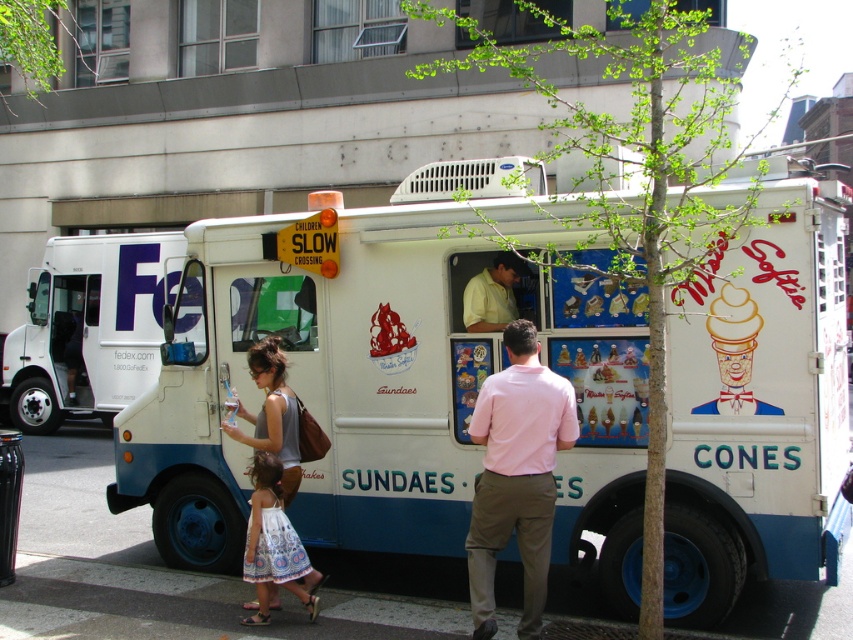
Is white matte ice cream truck at center further to camera compared to matte gray tank top at center?

No, it is in front of matte gray tank top at center.

Is white matte ice cream truck at center taller than matte gray tank top at center?

Yes, white matte ice cream truck at center is taller than matte gray tank top at center.

At what (x,y) coordinates should I click in order to perform the action: click on white matte ice cream truck at center. Please return your answer as a coordinate pair (x, y). Looking at the image, I should click on (317, 380).

What do you see at coordinates (317, 380) in the screenshot?
I see `white matte ice cream truck at center` at bounding box center [317, 380].

Does white matte ice cream truck at center appear over white printed dress at lower center?

Correct, white matte ice cream truck at center is located above white printed dress at lower center.

Which is in front, point (399, 272) or point (259, 529)?

Point (259, 529) is in front.

Locate an element on the screen. The height and width of the screenshot is (640, 853). white matte ice cream truck at center is located at coordinates (317, 380).

Who is more forward, (x=590, y=273) or (x=482, y=330)?

Point (x=590, y=273) is in front.

Does white matte ice cream truck at center have a larger size compared to yellow matte shirt at center?

Yes, white matte ice cream truck at center is bigger than yellow matte shirt at center.

The width and height of the screenshot is (853, 640). In order to click on white matte ice cream truck at center in this screenshot , I will do `click(317, 380)`.